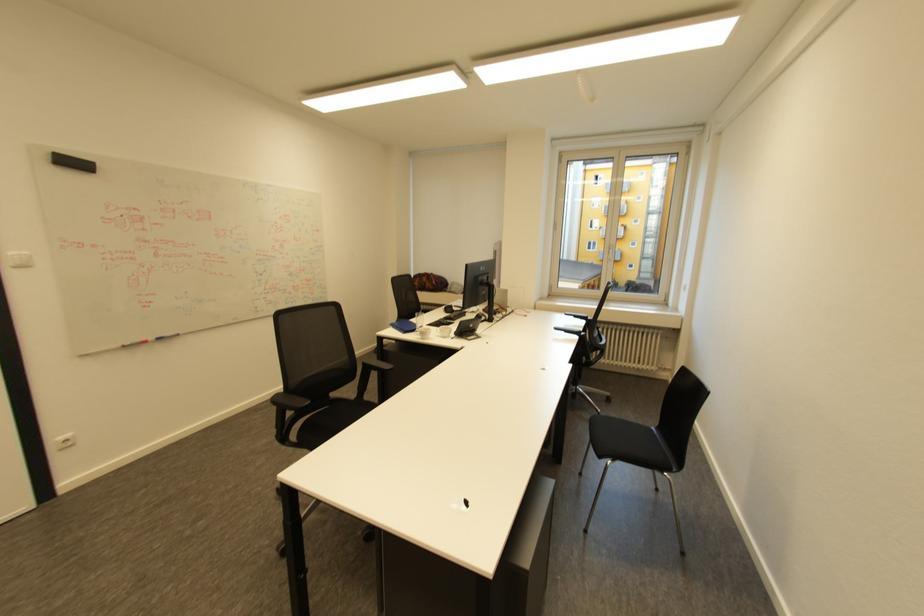
The width and height of the screenshot is (924, 616). What are the coordinates of `window handle` in the screenshot? It's located at (626, 270).